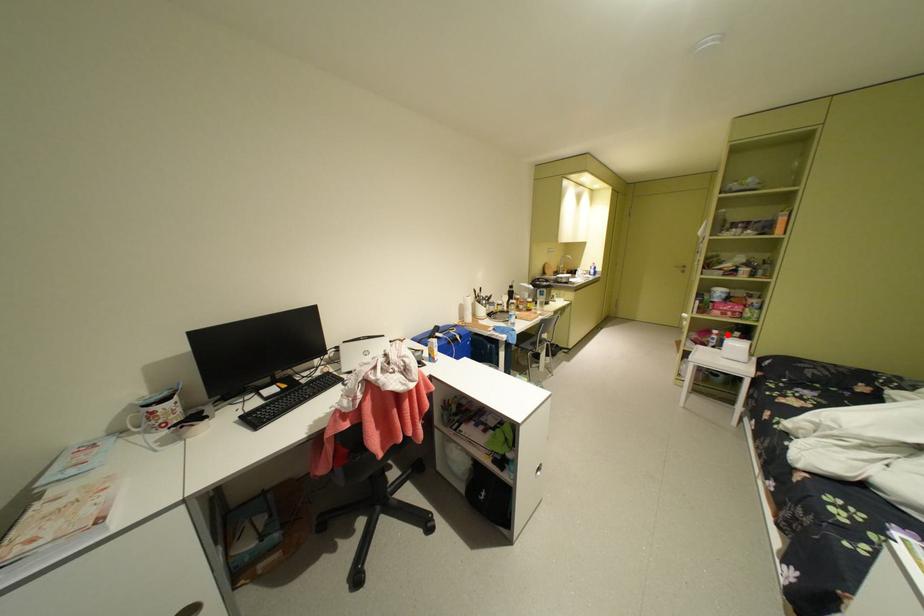
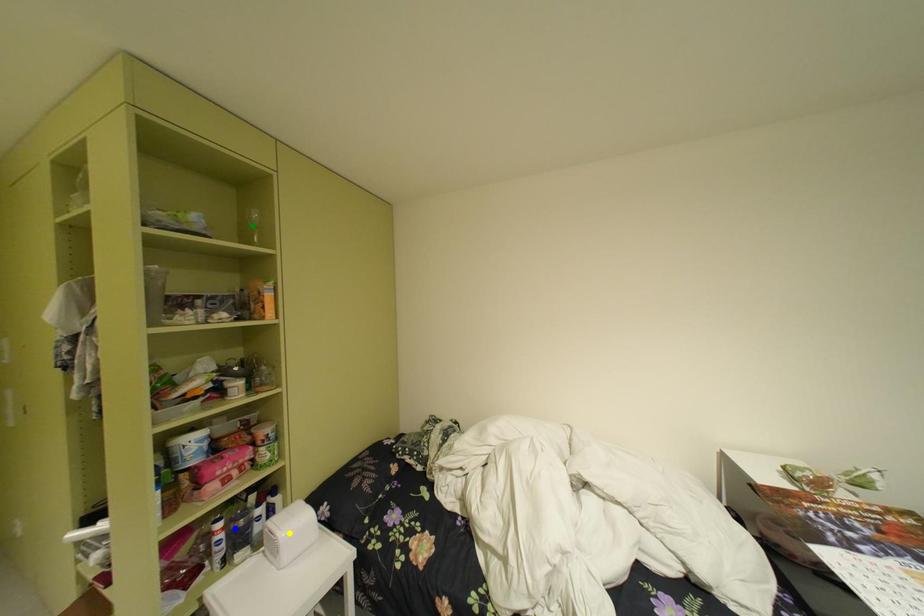
Question: I am providing you with two images of the same scene from different viewpoints. A red point is marked on the first image. You are given multiple points on the second image. Which spot in image 2 lines up with the point in image 1?

Choices:
 (A) green point
 (B) blue point
 (C) yellow point

Answer: (B)